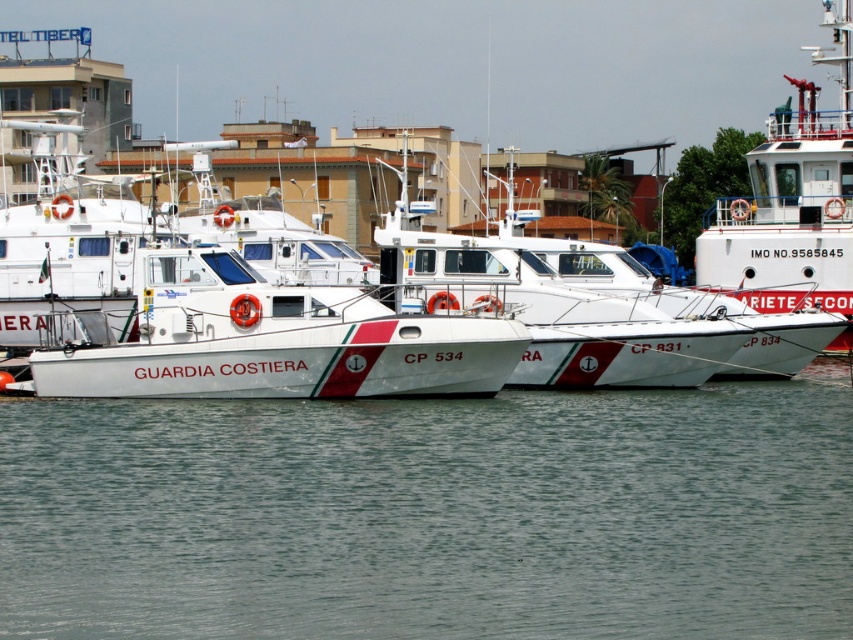
You are a harbor inspector tasked with checking the boats in the marina. You see the white glossy boat at center and the white matte ship at upper right. Which one is positioned lower in the image?

The white glossy boat at center is located below the white matte ship at upper right, so it is positioned lower in the image.

You are standing at the edge of the pier and want to locate two specific points in the image. The first point is at coordinates point (520,380) and the second is at point (850,244). Which of these points is nearer to you?

Point (520,380) is closer to the viewer than point (850,244).